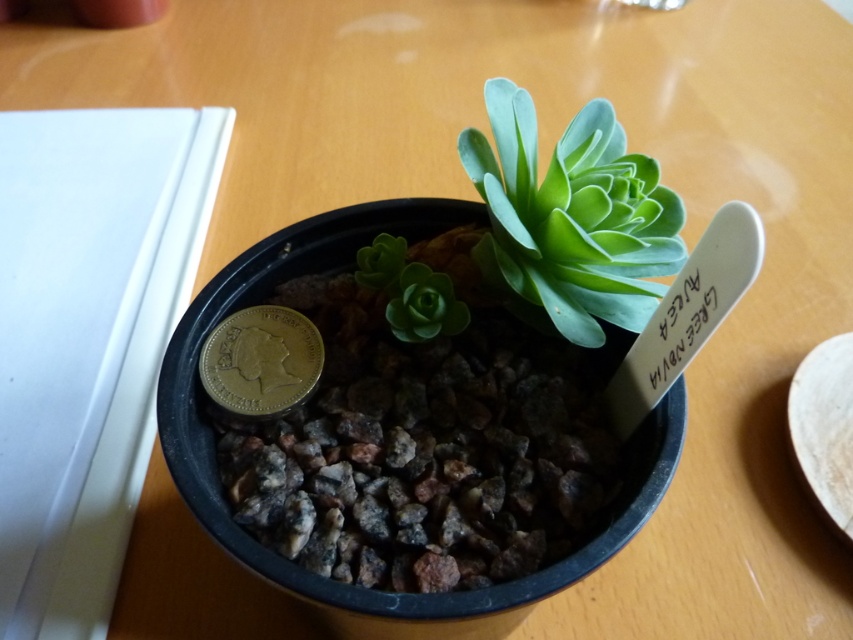
Question: Can you confirm if green succulent at center is smaller than gold plated coin at center?

Choices:
 (A) no
 (B) yes

Answer: (A)

Question: Which point is farther to the camera?

Choices:
 (A) (283, 410)
 (B) (583, 177)

Answer: (A)

Question: Which point appears farthest from the camera in this image?

Choices:
 (A) (654, 166)
 (B) (287, 333)

Answer: (B)

Question: Is green succulent at center above gold plated coin at center?

Choices:
 (A) no
 (B) yes

Answer: (B)

Question: From the image, what is the correct spatial relationship of green succulent at center in relation to gold plated coin at center?

Choices:
 (A) left
 (B) right

Answer: (B)